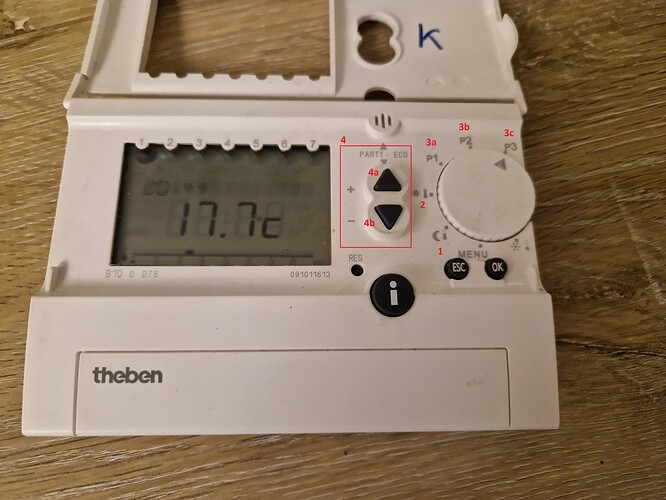
Find the location of a particular element. lcd readout screen is located at coordinates click(310, 215).